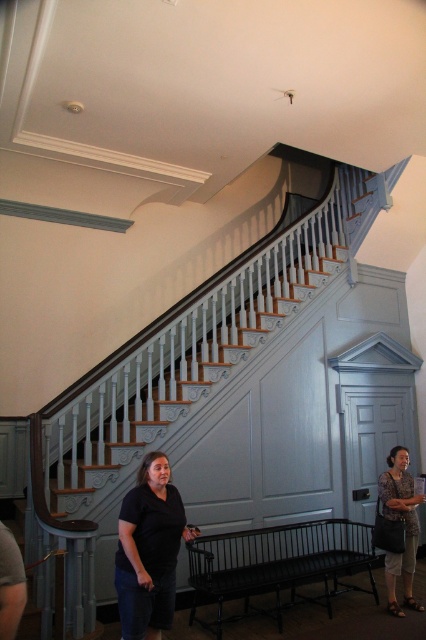
Is white wood staircase at center wider than black metal bench at lower center?

Indeed, white wood staircase at center has a greater width compared to black metal bench at lower center.

Identify the location of white wood staircase at center. click(221, 397).

Does black metal bench at lower center come behind printed fabric blouse at lower right?

No, black metal bench at lower center is closer to the viewer.

What do you see at coordinates (278, 566) in the screenshot?
I see `black metal bench at lower center` at bounding box center [278, 566].

Locate an element on the screen. black metal bench at lower center is located at coordinates (278, 566).

Can you confirm if white wood staircase at center is wider than black cotton shirt at lower center?

Yes.

I want to click on white wood staircase at center, so click(221, 397).

At what (x,y) coordinates should I click in order to perform the action: click on white wood staircase at center. Please return your answer as a coordinate pair (x, y). The image size is (426, 640). Looking at the image, I should click on (221, 397).